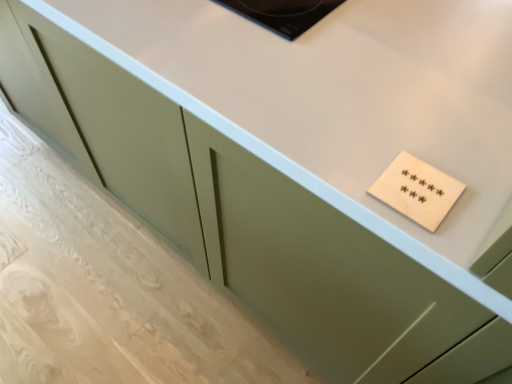
You are a GUI agent. You are given a task and a screenshot of the screen. Output one action in this format:
    pyautogui.click(x=<x>, y=<y>)
    Task: Click on the vacant space behind wooden plaque at upper right
    The height and width of the screenshot is (384, 512).
    Given the screenshot: What is the action you would take?
    pyautogui.click(x=406, y=119)